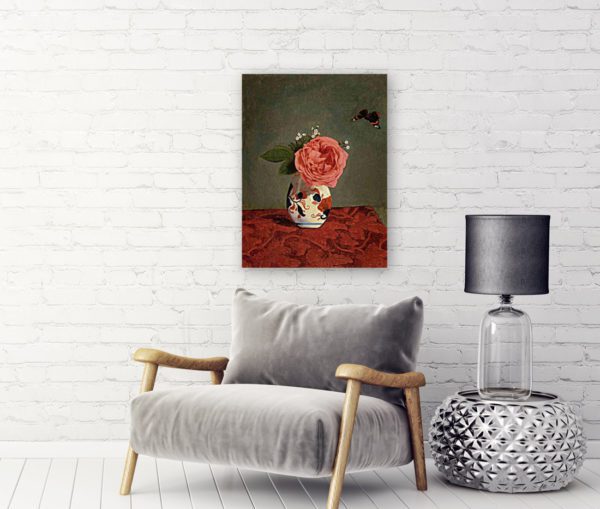
Locate an element on the screen. Image resolution: width=600 pixels, height=509 pixels. red floral tablecloth is located at coordinates (331, 237).